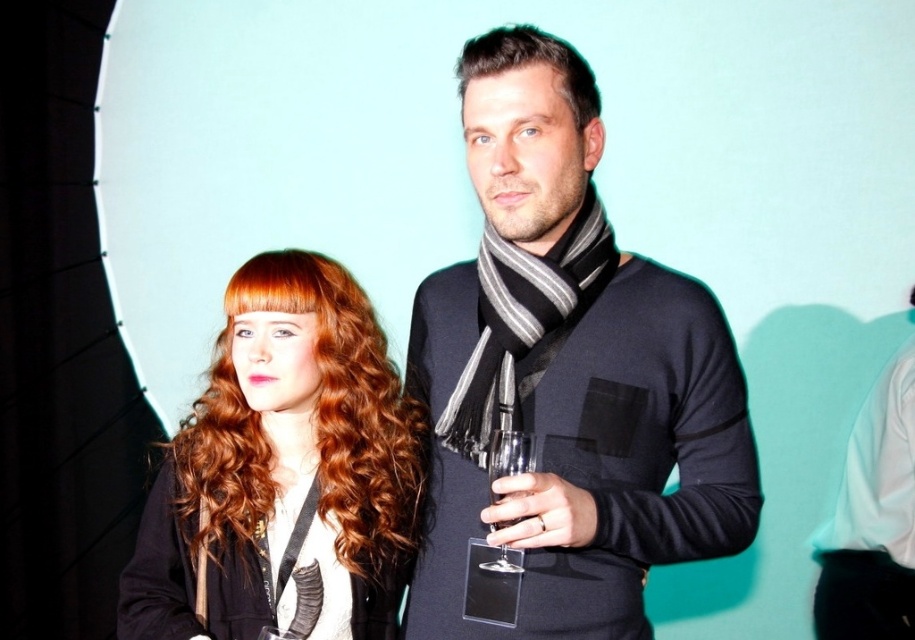
You are a photographer adjusting the lighting in the studio. You notice a shiny red hair at center located at point (283, 467). To ensure proper exposure, you need to place a reflector at a point that is 0.1 units to the right and 0.05 units above this location. What are the coordinates of the reflector?

The reflector should be placed at coordinates 0.830, 0.360. This is calculated by adding 0.1 to the x coordinate and 0.05 to the y coordinate of the shiny red hair at center at point (283, 467).

You are a photographer setting up a camera at position point 0.0, 0.0. You want to focus on the matte black scarf at center. What are the coordinates you should aim the camera at?

The coordinates to aim the camera at are point (568,369), which is where the matte black scarf at center is located.

You are a photographer adjusting your camera settings to capture the two people in the scene. You notice the shiny red hair at center and the matte black glass at center. Which object should you focus on first if you want to ensure the entire scene is in sharp focus?

The shiny red hair at center has a larger width than the matte black glass at center, so focusing on the wider object first will help ensure the entire scene is in sharp focus.